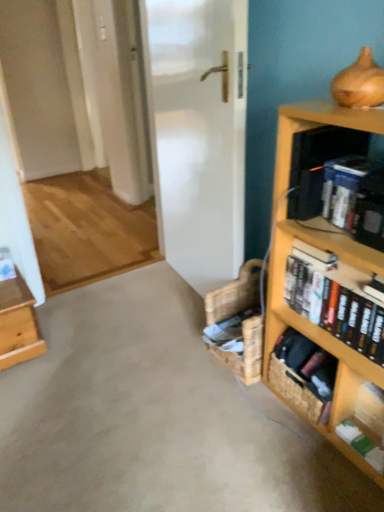
Where is `unoccupied area behind light brown wooden table at left`? unoccupied area behind light brown wooden table at left is located at coordinates (63, 307).